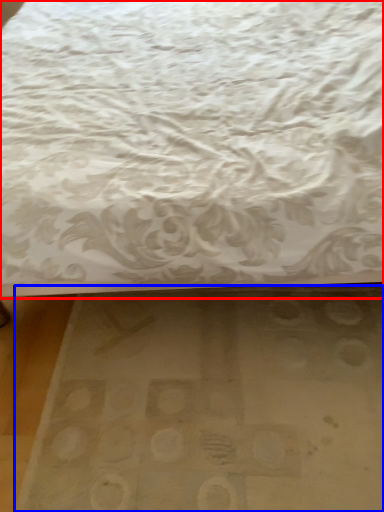
Question: Which object is closer to the camera taking this photo, bed (highlighted by a red box) or mat (highlighted by a blue box)?

Choices:
 (A) bed
 (B) mat

Answer: (A)